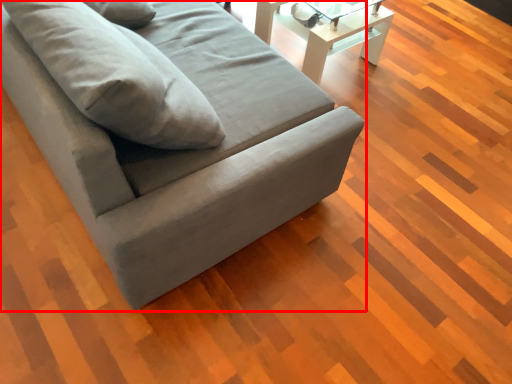
Question: Considering the relative positions of studio couch (annotated by the red box) and table in the image provided, where is studio couch (annotated by the red box) located with respect to the staircase?

Choices:
 (A) right
 (B) left

Answer: (B)